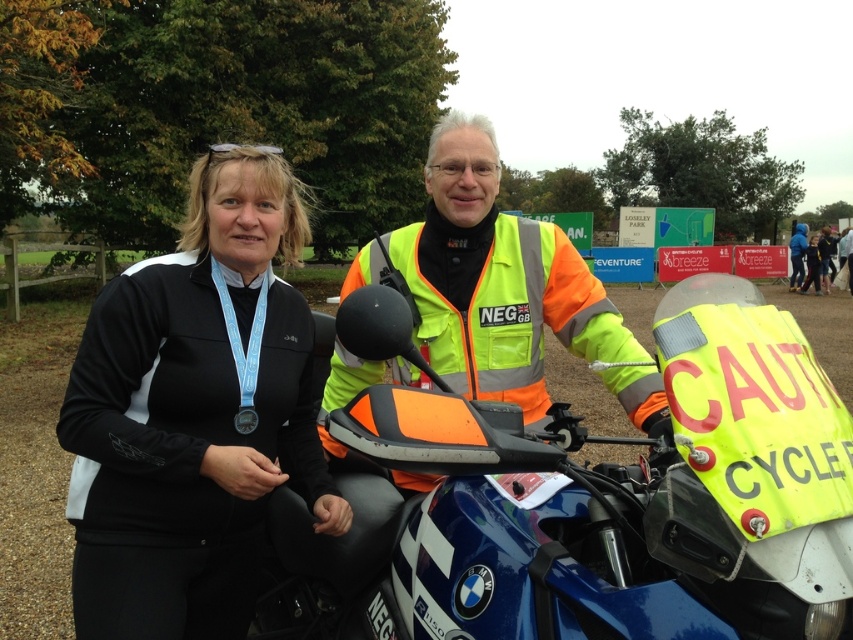
Question: Does metallic blue motorcycle at center appear under black fabric jacket at upper left?

Choices:
 (A) yes
 (B) no

Answer: (A)

Question: Which of these objects is positioned farthest from the neon yellow reflective jacket at center?

Choices:
 (A) black fabric jacket at upper left
 (B) silver metallic medal at center

Answer: (B)

Question: Which of the following is the closest to the observer?

Choices:
 (A) [x=242, y=420]
 (B) [x=654, y=339]

Answer: (B)

Question: Which point is farther to the camera?

Choices:
 (A) metallic blue motorcycle at center
 (B) black fabric jacket at upper left
 (C) silver metallic medal at center

Answer: (C)

Question: Can you confirm if metallic blue motorcycle at center is thinner than neon yellow reflective jacket at center?

Choices:
 (A) no
 (B) yes

Answer: (A)

Question: Observing the image, what is the correct spatial positioning of yellow reflective jacket at center in reference to silver metallic medal at center?

Choices:
 (A) left
 (B) right

Answer: (B)